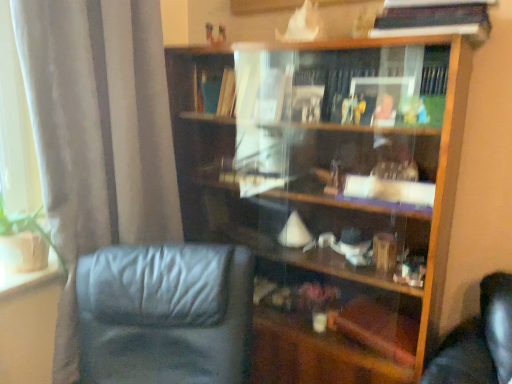
Question: From a real-world perspective, is satin gray curtain at left above or below hardcover book at upper right?

Choices:
 (A) above
 (B) below

Answer: (B)

Question: Based on their positions, is satin gray curtain at left located to the left or right of hardcover book at upper right?

Choices:
 (A) left
 (B) right

Answer: (A)

Question: Which object is the closest to the hardcover book at upper right?

Choices:
 (A) black leather chair at lower left
 (B) wooden bookcase at center
 (C) satin gray curtain at left

Answer: (B)

Question: Estimate the real-world distances between objects in this image. Which object is closer to the hardcover book at upper right?

Choices:
 (A) satin gray curtain at left
 (B) black leather chair at lower left
 (C) wooden bookcase at center

Answer: (C)